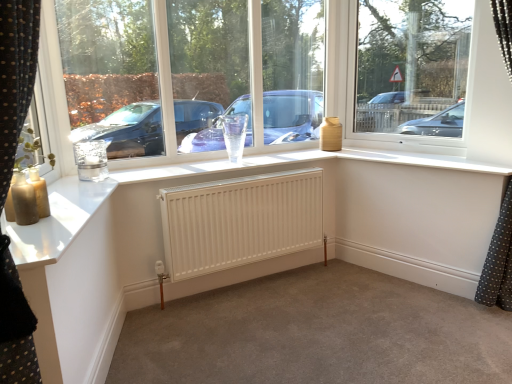
Identify the location of free spot to the right of white matte radiator at center. The height and width of the screenshot is (384, 512). (349, 299).